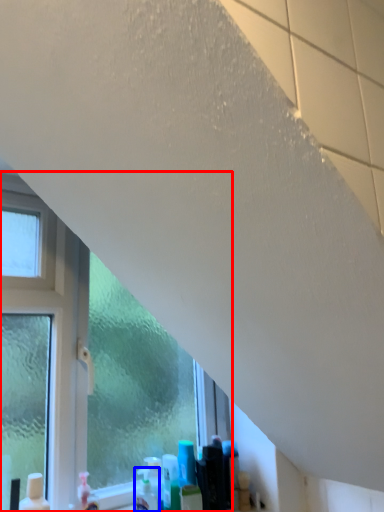
Question: Which point is closer to the camera, window (highlighted by a red box) or cleaning product (highlighted by a blue box)?

Choices:
 (A) window
 (B) cleaning product

Answer: (A)